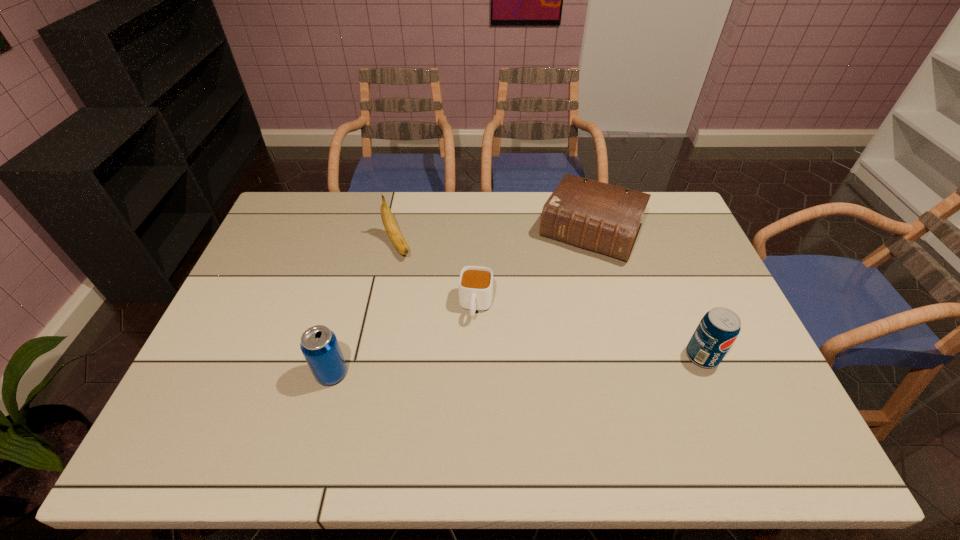
Identify the location of vacant space on the desktop that is between the leftmost object and the right pop and is positioned at the start of the peel on the banana. The height and width of the screenshot is (540, 960). (479, 366).

Where is `free space on the desktop that is between the left pop and the right pop and is positioned on the spine side of the second shortest object`? The height and width of the screenshot is (540, 960). free space on the desktop that is between the left pop and the right pop and is positioned on the spine side of the second shortest object is located at coordinates (522, 364).

You are a GUI agent. You are given a task and a screenshot of the screen. Output one action in this format:
    pyautogui.click(x=<x>, y=<y>)
    Task: Click on the vacant space on the desktop that is between the left pop and the right pop and is positioned on the side with the handle of the third object from right to left
    Image resolution: width=960 pixels, height=540 pixels.
    Given the screenshot: What is the action you would take?
    pyautogui.click(x=467, y=367)